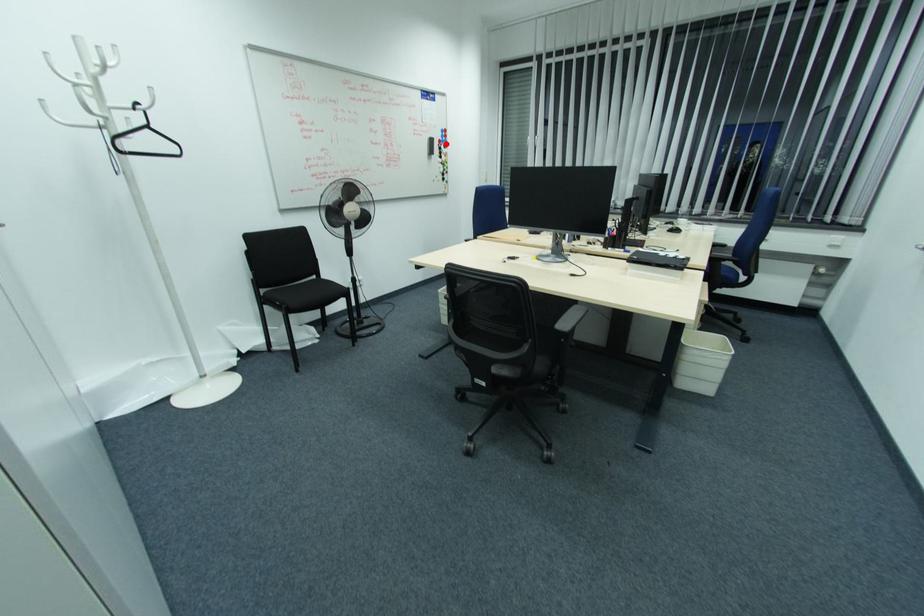
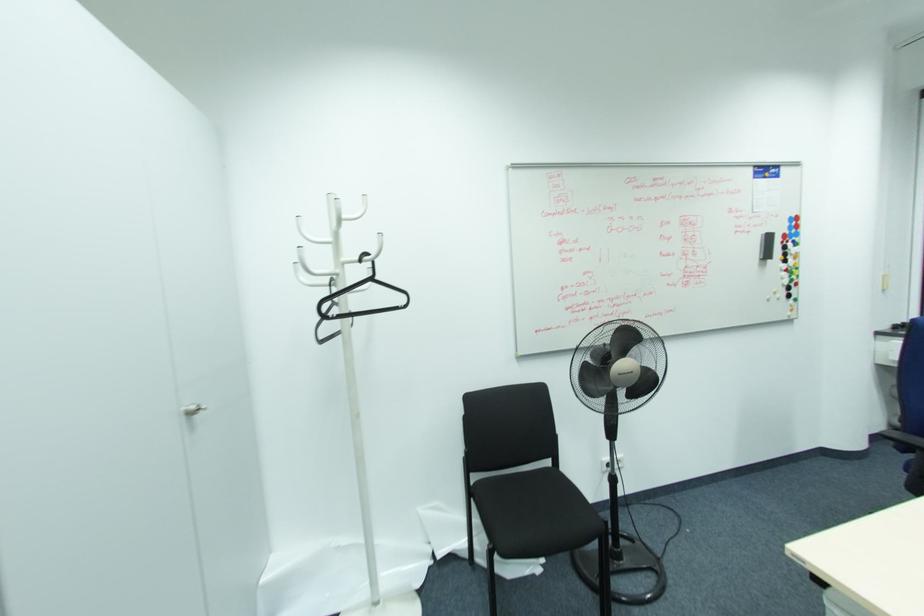
Find the pixel in the second image that matches the highlighted location in the first image.

(796, 238)